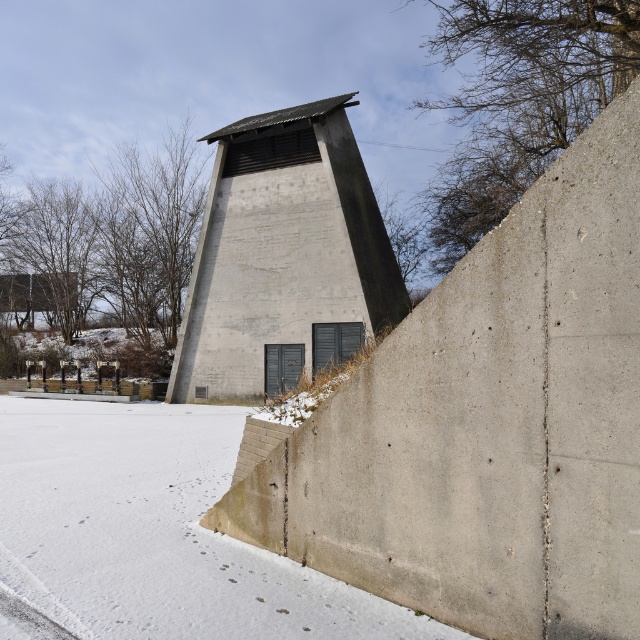
Question: Among these points, which one is nearest to the camera?

Choices:
 (A) (349, 600)
 (B) (244, 157)

Answer: (A)

Question: From the image, what is the correct spatial relationship of white powdery snow at lower left in relation to concrete tower at center?

Choices:
 (A) left
 (B) right

Answer: (A)

Question: Is white powdery snow at lower left closer to camera compared to concrete tower at center?

Choices:
 (A) no
 (B) yes

Answer: (B)

Question: Can you confirm if white powdery snow at lower left is wider than concrete tower at center?

Choices:
 (A) yes
 (B) no

Answer: (B)

Question: Which point is farther to the camera?

Choices:
 (A) (186, 433)
 (B) (301, 269)

Answer: (B)

Question: Which point is farther to the camera?

Choices:
 (A) coord(337,586)
 (B) coord(320,157)

Answer: (B)